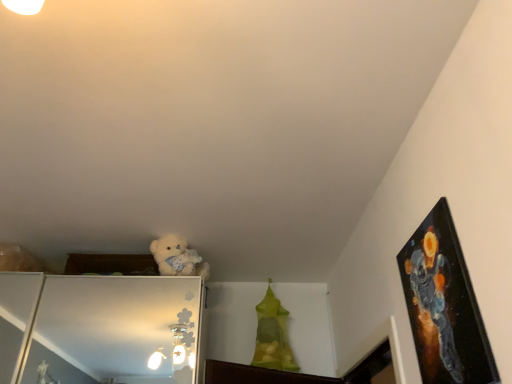
Question: Does fluffy white teddy bear at upper center have a smaller size compared to black glossy picture frame at upper right?

Choices:
 (A) no
 (B) yes

Answer: (A)

Question: Is fluffy white teddy bear at upper center at the right side of black glossy picture frame at upper right?

Choices:
 (A) yes
 (B) no

Answer: (B)

Question: Is fluffy white teddy bear at upper center to the left of black glossy picture frame at upper right from the viewer's perspective?

Choices:
 (A) no
 (B) yes

Answer: (B)

Question: Considering the relative sizes of fluffy white teddy bear at upper center and black glossy picture frame at upper right in the image provided, is fluffy white teddy bear at upper center taller than black glossy picture frame at upper right?

Choices:
 (A) no
 (B) yes

Answer: (A)

Question: Does fluffy white teddy bear at upper center turn towards black glossy picture frame at upper right?

Choices:
 (A) yes
 (B) no

Answer: (B)

Question: Is there a large distance between fluffy white teddy bear at upper center and black glossy picture frame at upper right?

Choices:
 (A) no
 (B) yes

Answer: (B)

Question: Are black glossy picture frame at upper right and fluffy white teddy bear at upper center making contact?

Choices:
 (A) no
 (B) yes

Answer: (A)

Question: Can you confirm if black glossy picture frame at upper right is wider than fluffy white teddy bear at upper center?

Choices:
 (A) yes
 (B) no

Answer: (B)

Question: From a real-world perspective, is black glossy picture frame at upper right located beneath fluffy white teddy bear at upper center?

Choices:
 (A) no
 (B) yes

Answer: (B)

Question: From the image's perspective, is black glossy picture frame at upper right above fluffy white teddy bear at upper center?

Choices:
 (A) no
 (B) yes

Answer: (B)

Question: Can you confirm if black glossy picture frame at upper right is smaller than fluffy white teddy bear at upper center?

Choices:
 (A) no
 (B) yes

Answer: (B)

Question: Is black glossy picture frame at upper right located outside fluffy white teddy bear at upper center?

Choices:
 (A) no
 (B) yes

Answer: (B)

Question: From a real-world perspective, is black glossy picture frame at upper right positioned above or below fluffy white teddy bear at upper center?

Choices:
 (A) above
 (B) below

Answer: (B)